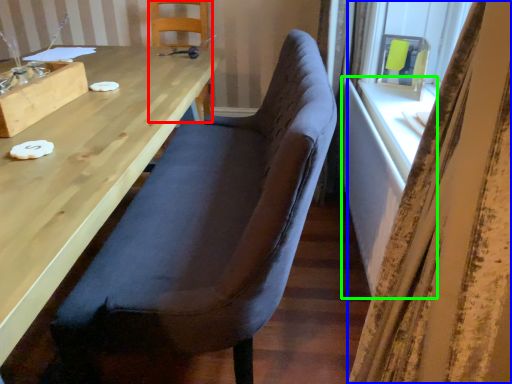
Question: Considering the real-world distances, which object is farthest from chair (highlighted by a red box)? curtain (highlighted by a blue box) or table (highlighted by a green box)?

Choices:
 (A) curtain
 (B) table

Answer: (A)